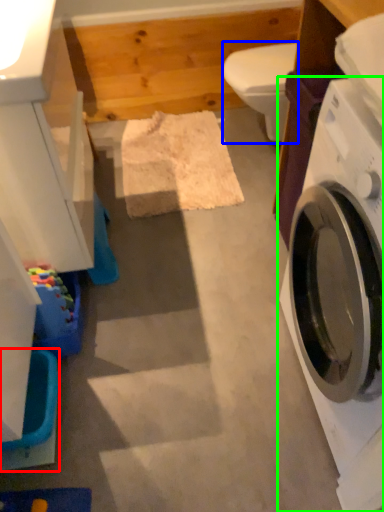
Question: Estimate the real-world distances between objects in this image. Which object is closer to washer (highlighted by a red box), toilet bowl (highlighted by a blue box) or washing machine (highlighted by a green box)?

Choices:
 (A) toilet bowl
 (B) washing machine

Answer: (B)